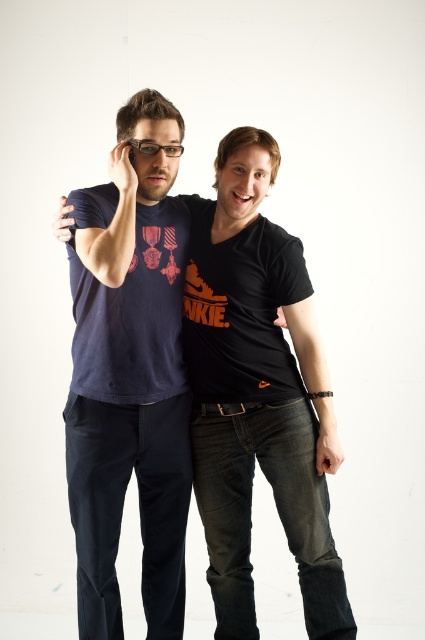
Question: Which point is closer to the camera?

Choices:
 (A) black matte hand at center
 (B) black leather bracelet at right
 (C) matte black phone at upper left
 (D) matte black hand at lower right

Answer: (C)

Question: Is navy blue t-shirt at left to the left of matte black glasses at upper center from the viewer's perspective?

Choices:
 (A) yes
 (B) no

Answer: (A)

Question: Can you confirm if black leather bracelet at right is positioned to the left of matte black glasses at upper center?

Choices:
 (A) yes
 (B) no

Answer: (B)

Question: Where is matte black hand at lower right located in relation to matte black phone at upper left in the image?

Choices:
 (A) right
 (B) left

Answer: (A)

Question: Among these objects, which one is farthest from the camera?

Choices:
 (A) black matte hand at center
 (B) matte black t-shirt at center

Answer: (A)

Question: Which point is closer to the camera?

Choices:
 (A) black matte hand at center
 (B) matte black t-shirt at center

Answer: (B)